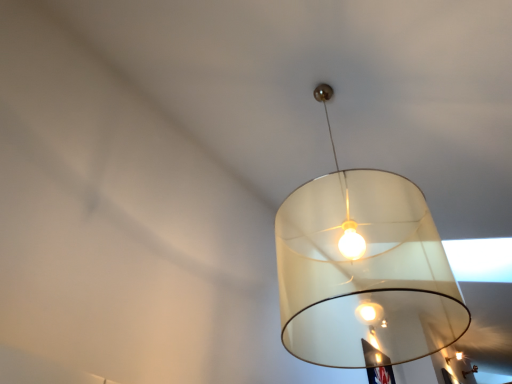
Question: Is point (340, 355) positioned closer to the camera than point (465, 372)?

Choices:
 (A) closer
 (B) farther

Answer: (B)

Question: Would you say translucent white lampshade at upper center, which ranks as the third lamp in back-to-front order, is to the left or to the right of matte white lampshade at center, which appears as the third lamp when viewed from the front, in the picture?

Choices:
 (A) left
 (B) right

Answer: (A)

Question: Based on their relative distances, which object is nearer to the translucent white lampshade at upper center, which ranks as the third lamp in back-to-front order?

Choices:
 (A) matte white lampshade at center, which appears as the third lamp when viewed from the front
 (B) matte white lampshade at center, the second lamp ordered from the bottom

Answer: (B)

Question: Which object is the closest to the translucent white lampshade at upper center, which ranks as the third lamp in right-to-left order?

Choices:
 (A) matte white lampshade at center, the 3th lamp positioned from the top
 (B) matte white lampshade at center, acting as the 2th lamp starting from the top

Answer: (B)